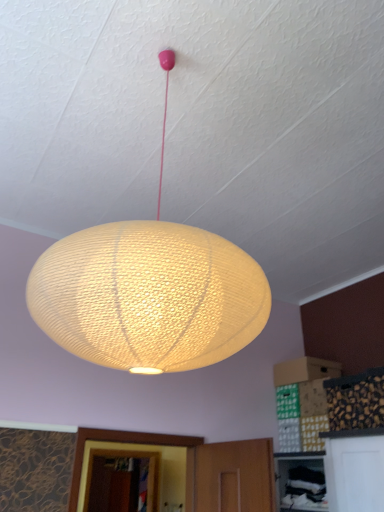
Question: Should I look upward or downward to see matte yellow woven lantern at center?

Choices:
 (A) up
 (B) down

Answer: (B)

Question: Should I look upward or downward to see matte white sphere at center?

Choices:
 (A) down
 (B) up

Answer: (B)

Question: Is matte white sphere at center looking in the opposite direction of matte yellow woven lantern at center?

Choices:
 (A) no
 (B) yes

Answer: (A)

Question: Is matte white sphere at center behind matte yellow woven lantern at center?

Choices:
 (A) yes
 (B) no

Answer: (B)

Question: Is matte white sphere at center placed right next to matte yellow woven lantern at center?

Choices:
 (A) no
 (B) yes

Answer: (B)

Question: Is matte white sphere at center located outside matte yellow woven lantern at center?

Choices:
 (A) yes
 (B) no

Answer: (A)

Question: Can you confirm if matte white sphere at center is thinner than matte yellow woven lantern at center?

Choices:
 (A) yes
 (B) no

Answer: (B)

Question: Is matte white sphere at center taller than matte yellow woven lantern at center?

Choices:
 (A) yes
 (B) no

Answer: (A)

Question: Is matte white sphere at center inside matte yellow woven lantern at center?

Choices:
 (A) no
 (B) yes

Answer: (A)

Question: From the image's perspective, is matte yellow woven lantern at center above matte white sphere at center?

Choices:
 (A) yes
 (B) no

Answer: (B)

Question: Is matte yellow woven lantern at center far away from matte white sphere at center?

Choices:
 (A) yes
 (B) no

Answer: (B)

Question: From the image's perspective, does matte yellow woven lantern at center appear lower than matte white sphere at center?

Choices:
 (A) yes
 (B) no

Answer: (A)

Question: Is matte yellow woven lantern at center taller than matte white sphere at center?

Choices:
 (A) no
 (B) yes

Answer: (A)

Question: Is matte yellow woven lantern at center positioned with its back to matte white sphere at center?

Choices:
 (A) yes
 (B) no

Answer: (B)

Question: Considering the positions of point (203, 270) and point (115, 262), is point (203, 270) closer or farther from the camera than point (115, 262)?

Choices:
 (A) closer
 (B) farther

Answer: (B)